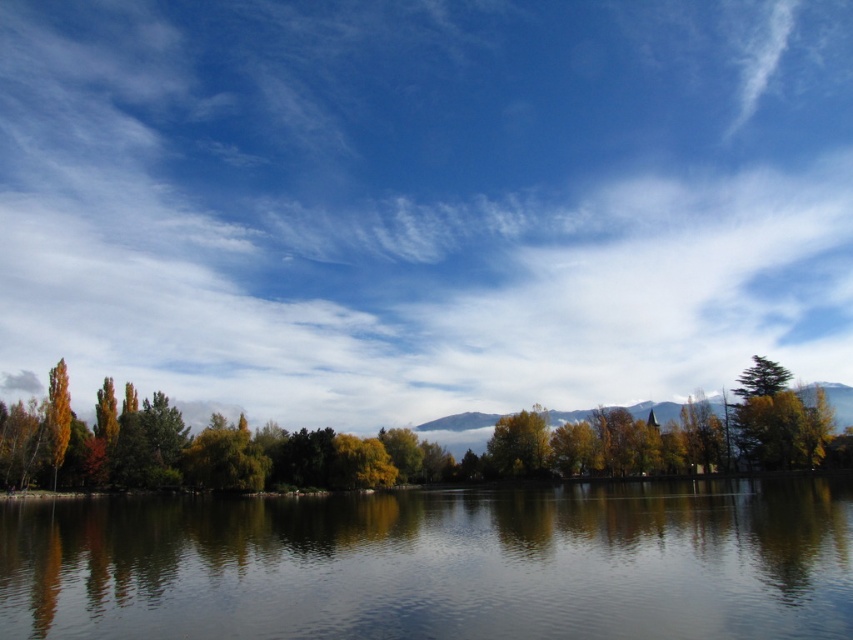
You are planning to take a photo of the green leafy tree at center and the orange matte tree at left. Which tree should you focus on if you want to capture the larger tree in your shot?

The green leafy tree at center is bigger than the orange matte tree at left, so you should focus on the green leafy tree at center to capture the larger tree in your shot.